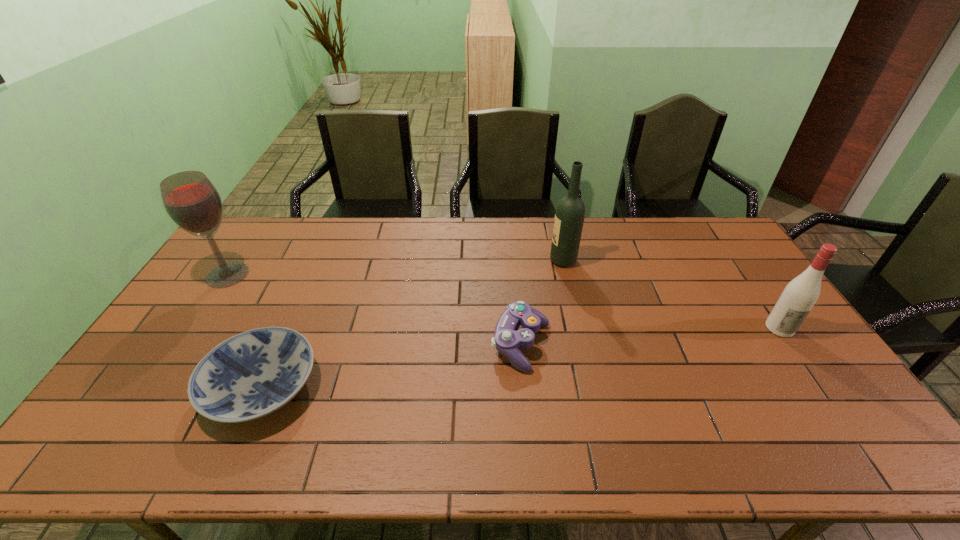
Find the location of a particular element. The width and height of the screenshot is (960, 540). vacant region at the near edge of the desktop is located at coordinates (181, 463).

Identify the location of vacant area at the left edge. The width and height of the screenshot is (960, 540). (166, 357).

In the image, there is a desktop. Where is `free region at the far left corner`? The height and width of the screenshot is (540, 960). free region at the far left corner is located at coordinates (275, 237).

You are a GUI agent. You are given a task and a screenshot of the screen. Output one action in this format:
    pyautogui.click(x=<x>, y=<y>)
    Task: Click on the free space at the far right corner of the desktop
    Image resolution: width=960 pixels, height=540 pixels.
    Given the screenshot: What is the action you would take?
    pyautogui.click(x=731, y=255)

You are a GUI agent. You are given a task and a screenshot of the screen. Output one action in this format:
    pyautogui.click(x=<x>, y=<y>)
    Task: Click on the free spot between the wine bottle and the control
    The image size is (960, 540).
    Given the screenshot: What is the action you would take?
    pyautogui.click(x=542, y=303)

Where is `vacant area between the control and the third shortest object`? vacant area between the control and the third shortest object is located at coordinates (650, 336).

Identify the location of empty space that is in between the wine bottle and the left alcohol. Image resolution: width=960 pixels, height=540 pixels. (396, 268).

At what (x,y) coordinates should I click in order to perform the action: click on vacant space in between the control and the shortest object. Please return your answer as a coordinate pair (x, y). Looking at the image, I should click on (392, 366).

Image resolution: width=960 pixels, height=540 pixels. I want to click on vacant point located between the control and the leftmost object, so click(374, 310).

This screenshot has width=960, height=540. What are the coordinates of `vacant area between the second object from left to right and the leftmost object` in the screenshot? It's located at (245, 331).